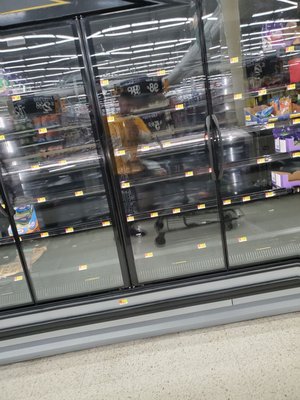
Where is `door handle`? door handle is located at coordinates (212, 173), (222, 176), (4, 215), (12, 214).